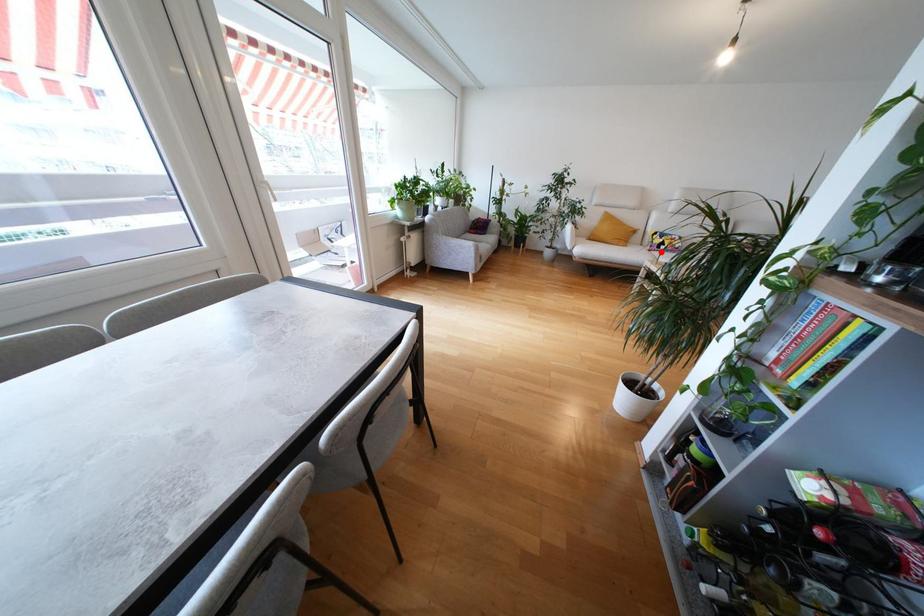
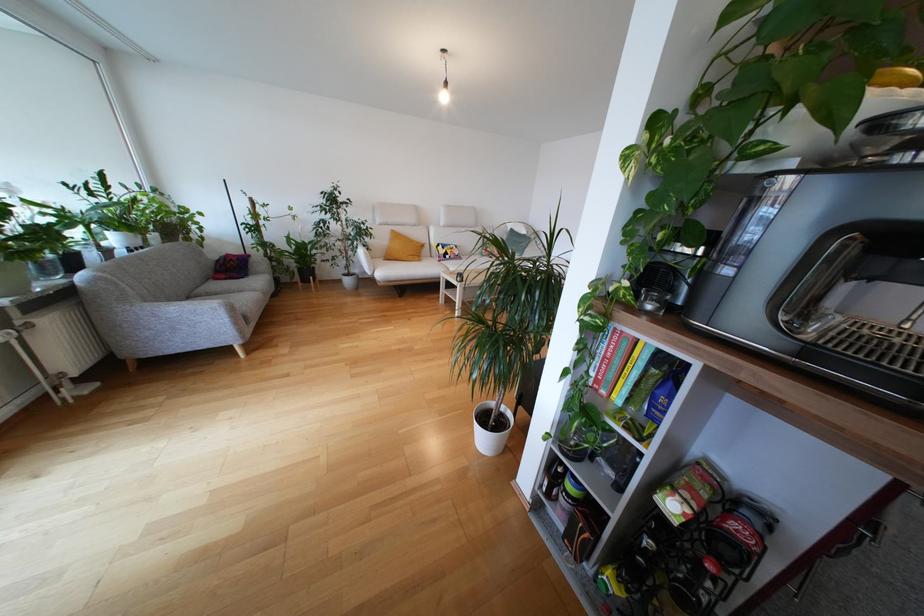
The point at the highlighted location is marked in the first image. Where is the corresponding point in the second image?

(448, 262)